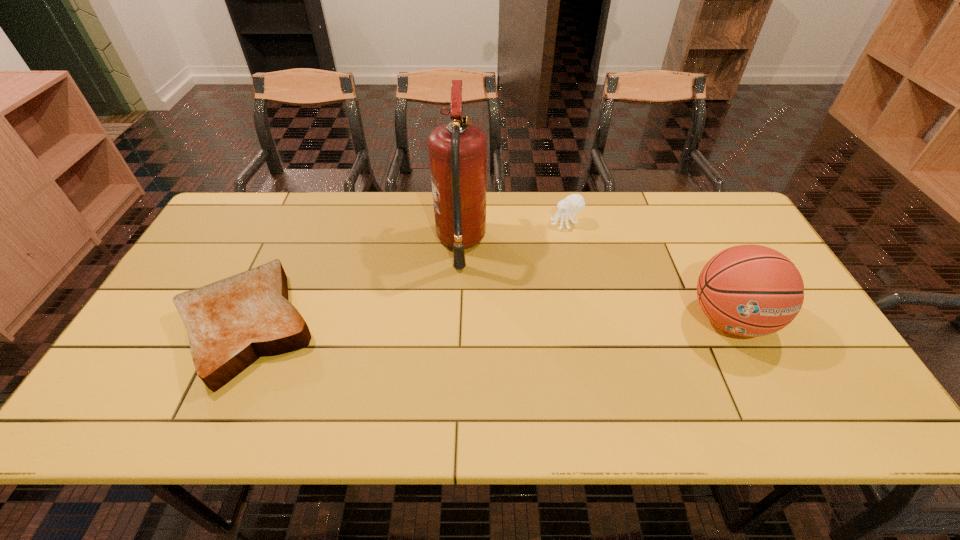
The height and width of the screenshot is (540, 960). I want to click on vacant area between the tallest object and the rightmost object, so click(x=595, y=281).

Where is `vacant space that's between the second tallest object and the third object from left to right`? The width and height of the screenshot is (960, 540). vacant space that's between the second tallest object and the third object from left to right is located at coordinates (648, 271).

Where is `free area in between the tallest object and the rightmost object`? Image resolution: width=960 pixels, height=540 pixels. free area in between the tallest object and the rightmost object is located at coordinates (595, 281).

Locate an element on the screen. This screenshot has width=960, height=540. vacant space in between the fire extinguisher and the basketball is located at coordinates (595, 281).

The image size is (960, 540). Find the location of `the third closest object to the third tallest object`. the third closest object to the third tallest object is located at coordinates (231, 323).

Identify which object is the nearest to the fire extinguisher. Please provide its 2D coordinates. Your answer should be formatted as a tuple, i.e. [(x, y)], where the tuple contains the x and y coordinates of a point satisfying the conditions above.

[(574, 203)]